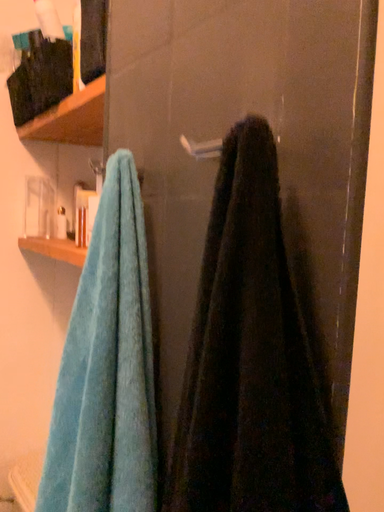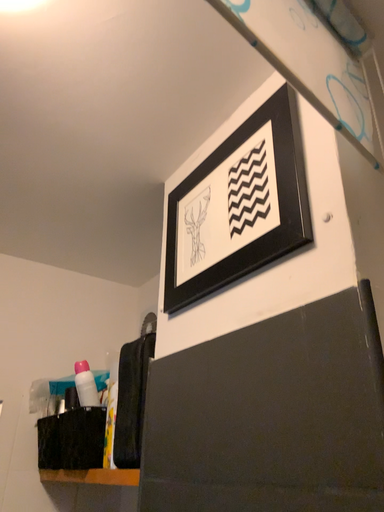
Question: Which way did the camera rotate in the video?

Choices:
 (A) rotated upward
 (B) rotated downward

Answer: (A)